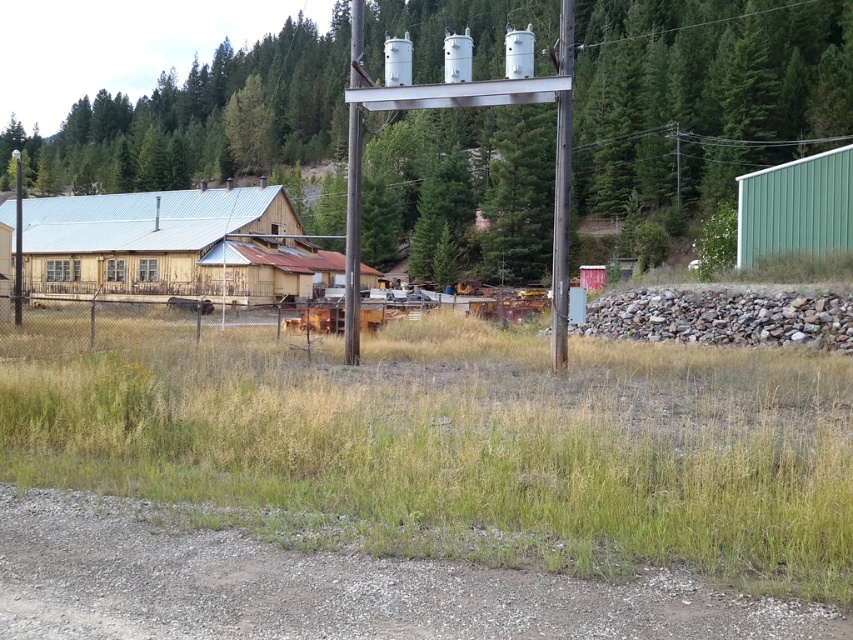
Does smooth gray pole at center have a greater width compared to rusty metal cow at center?

Yes, smooth gray pole at center is wider than rusty metal cow at center.

How distant is smooth gray pole at center from rusty metal cow at center?

They are 20.54 meters apart.

What do you see at coordinates (352, 236) in the screenshot? I see `smooth gray pole at center` at bounding box center [352, 236].

Image resolution: width=853 pixels, height=640 pixels. In order to click on smooth gray pole at center in this screenshot , I will do `click(352, 236)`.

Is metallic gray pole at center taller than rusty metal cow at center?

Correct, metallic gray pole at center is much taller as rusty metal cow at center.

From the picture: Is metallic gray pole at center above rusty metal cow at center?

Yes, metallic gray pole at center is above rusty metal cow at center.

Is point (561, 49) behind point (369, 321)?

No, it is not.

The height and width of the screenshot is (640, 853). Find the location of `metallic gray pole at center`. metallic gray pole at center is located at coordinates (561, 189).

Does metallic gray pole at center have a lesser height compared to smooth gray pole at center?

Correct, metallic gray pole at center is not as tall as smooth gray pole at center.

Does point (561, 364) come behind point (351, 340)?

No.

This screenshot has width=853, height=640. What are the coordinates of `metallic gray pole at center` in the screenshot? It's located at (561, 189).